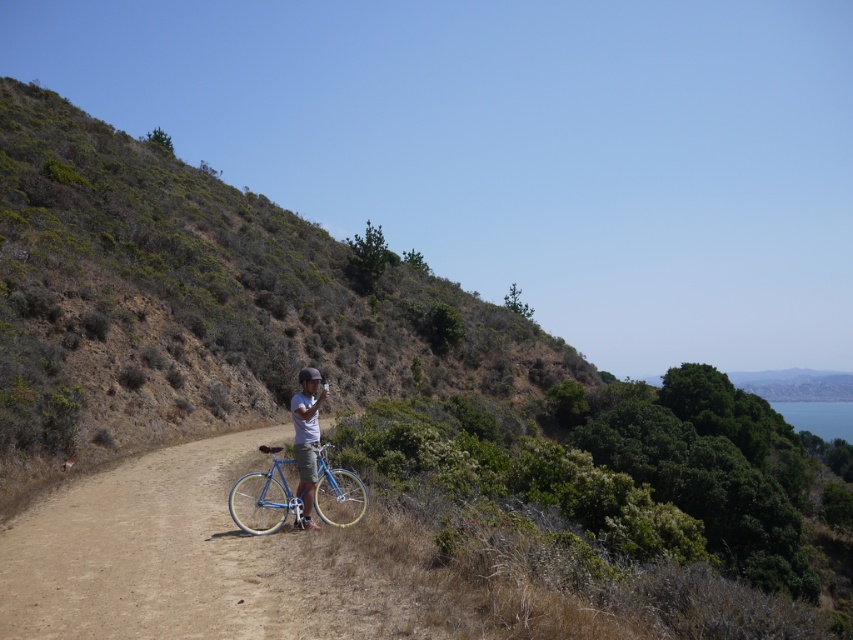
Based on the photo, you are a photographer trying to capture a wide shot of both the shiny blue frame at center and the matte blue bicycle at center. Given that your camera can only focus on objects within a 3 meter width, will you be able to fit both objects into the frame without moving closer?

The shiny blue frame at center is wider than the matte blue bicycle at center. Since the camera can only focus on objects within a 3 meter width, you need to check if the combined width of both objects exceeds this limit. However, the exact widths are not provided, so it is uncertain if they can both fit without moving closer.

You are a photographer trying to capture both the shiny blue frame at center and the matte blue bicycle at center in a single shot. Which object should you focus on first to ensure both are in frame?

The shiny blue frame at center is bigger than the matte blue bicycle at center, so you should focus on the shiny blue frame at center first to ensure both are in frame.

You are a photographer trying to capture the shiny blue frame at center in your shot. Based on its position, where should you aim your camera to ensure it is centered in your viewfinder?

You should aim your camera at point (264, 499) to center the shiny blue frame at center in your viewfinder.